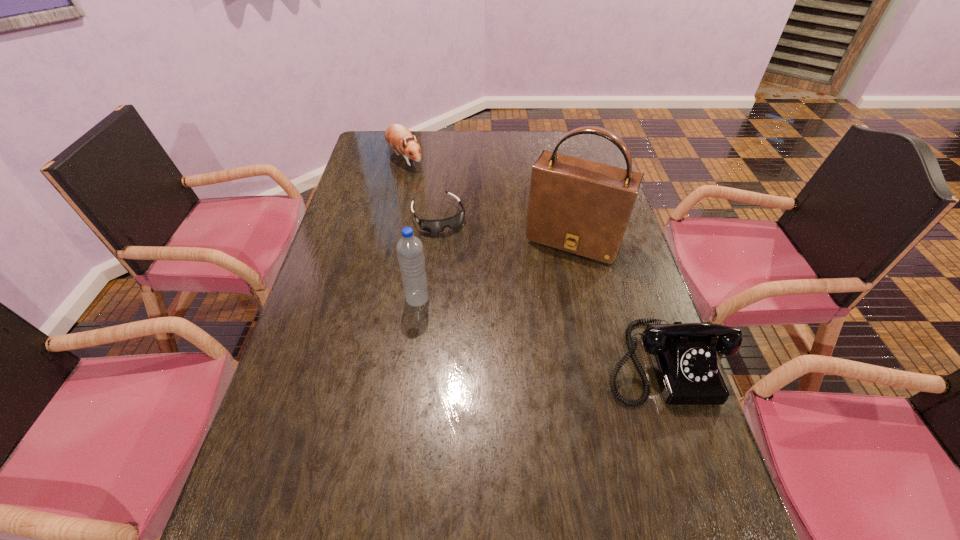
Locate an element on the screen. free space located at the face of the fourth tallest object is located at coordinates (428, 192).

This screenshot has height=540, width=960. I want to click on vacant space located 0.280m at the face of the fourth tallest object, so click(x=444, y=213).

Find the location of a particular element. The image size is (960, 540). free space located on the front and sides of the shortest object is located at coordinates (456, 247).

You are a GUI agent. You are given a task and a screenshot of the screen. Output one action in this format:
    pyautogui.click(x=<x>, y=<y>)
    Task: Click on the free spot located on the front and sides of the shortest object
    
    Given the screenshot: What is the action you would take?
    pyautogui.click(x=466, y=265)

At what (x,y) coordinates should I click in order to perform the action: click on vacant space located 0.250m on the front and sides of the shortest object. Please return your answer as a coordinate pair (x, y). Looking at the image, I should click on (479, 288).

The image size is (960, 540). What are the coordinates of `free point located on the front flap of the shoulder bag` in the screenshot? It's located at (535, 310).

At what (x,y) coordinates should I click in order to perform the action: click on vacant space situated 0.110m on the front flap of the shoulder bag. Please return your answer as a coordinate pair (x, y). Image resolution: width=960 pixels, height=540 pixels. Looking at the image, I should click on (545, 289).

What are the coordinates of `free spot located 0.330m on the front flap of the shoulder bag` in the screenshot? It's located at (516, 351).

The width and height of the screenshot is (960, 540). Identify the location of object at the far edge. (397, 136).

Where is `object that is positioned at the left edge`? This screenshot has height=540, width=960. object that is positioned at the left edge is located at coordinates (397, 136).